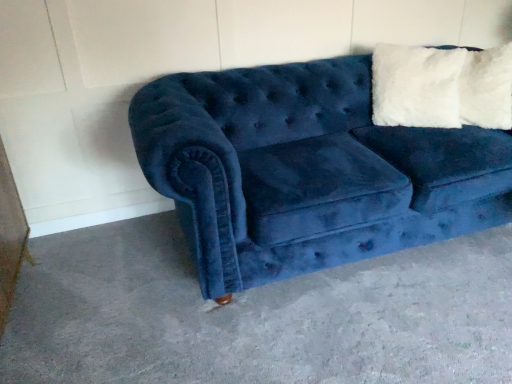
Question: Considering the relative sizes of blue velvet couch at lower right and velvet blue couch at center in the image provided, is blue velvet couch at lower right wider than velvet blue couch at center?

Choices:
 (A) no
 (B) yes

Answer: (B)

Question: Could you tell me if blue velvet couch at lower right is turned towards velvet blue couch at center?

Choices:
 (A) yes
 (B) no

Answer: (B)

Question: Considering the relative sizes of blue velvet couch at lower right and velvet blue couch at center in the image provided, is blue velvet couch at lower right taller than velvet blue couch at center?

Choices:
 (A) yes
 (B) no

Answer: (B)

Question: Is there a large distance between blue velvet couch at lower right and velvet blue couch at center?

Choices:
 (A) no
 (B) yes

Answer: (A)

Question: Can you confirm if blue velvet couch at lower right is shorter than velvet blue couch at center?

Choices:
 (A) yes
 (B) no

Answer: (A)

Question: Is blue velvet couch at lower right directly adjacent to velvet blue couch at center?

Choices:
 (A) yes
 (B) no

Answer: (B)

Question: Is velvet blue couch at center at the left side of blue velvet couch at lower right?

Choices:
 (A) no
 (B) yes

Answer: (A)

Question: Can you confirm if velvet blue couch at center is wider than blue velvet couch at lower right?

Choices:
 (A) yes
 (B) no

Answer: (B)

Question: Are velvet blue couch at center and blue velvet couch at lower right located far from each other?

Choices:
 (A) no
 (B) yes

Answer: (A)

Question: Does velvet blue couch at center come in front of blue velvet couch at lower right?

Choices:
 (A) no
 (B) yes

Answer: (A)

Question: Does velvet blue couch at center lie behind blue velvet couch at lower right?

Choices:
 (A) yes
 (B) no

Answer: (A)

Question: Can you confirm if velvet blue couch at center is thinner than blue velvet couch at lower right?

Choices:
 (A) yes
 (B) no

Answer: (A)

Question: Considering the relative positions of velvet blue couch at center and blue velvet couch at lower right in the image provided, is velvet blue couch at center to the left or to the right of blue velvet couch at lower right?

Choices:
 (A) right
 (B) left

Answer: (A)